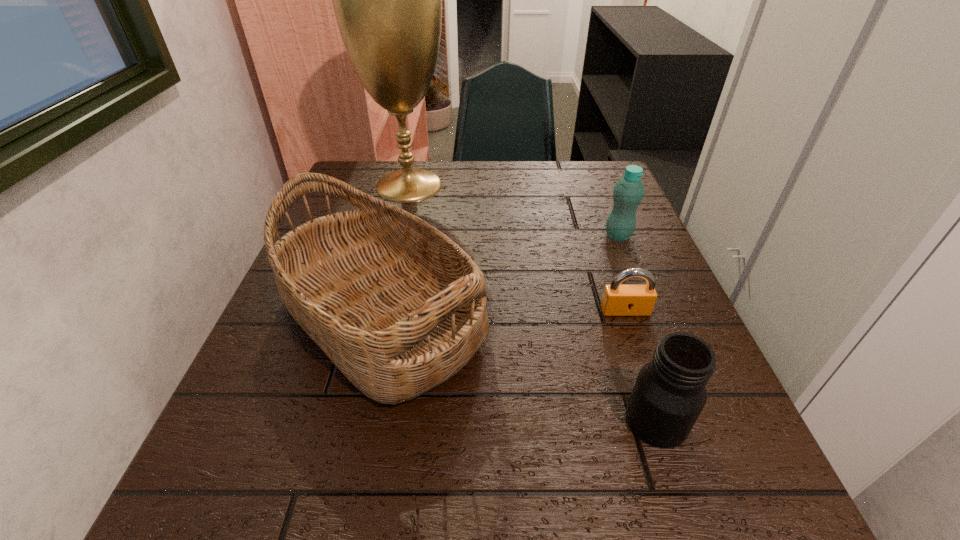
The height and width of the screenshot is (540, 960). I want to click on free point between the shortest object and the jar, so click(x=640, y=366).

You are a GUI agent. You are given a task and a screenshot of the screen. Output one action in this format:
    pyautogui.click(x=<x>, y=<y>)
    Task: Click on the object that is the third nearest to the jar
    The width and height of the screenshot is (960, 540).
    Given the screenshot: What is the action you would take?
    pyautogui.click(x=628, y=192)

What are the coordinates of `the fourth closest object relative to the basket` in the screenshot? It's located at (628, 192).